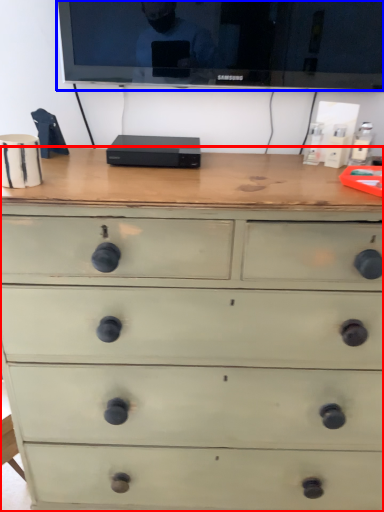
Question: Among these objects, which one is farthest to the camera, chest of drawers (highlighted by a red box) or television (highlighted by a blue box)?

Choices:
 (A) chest of drawers
 (B) television

Answer: (B)